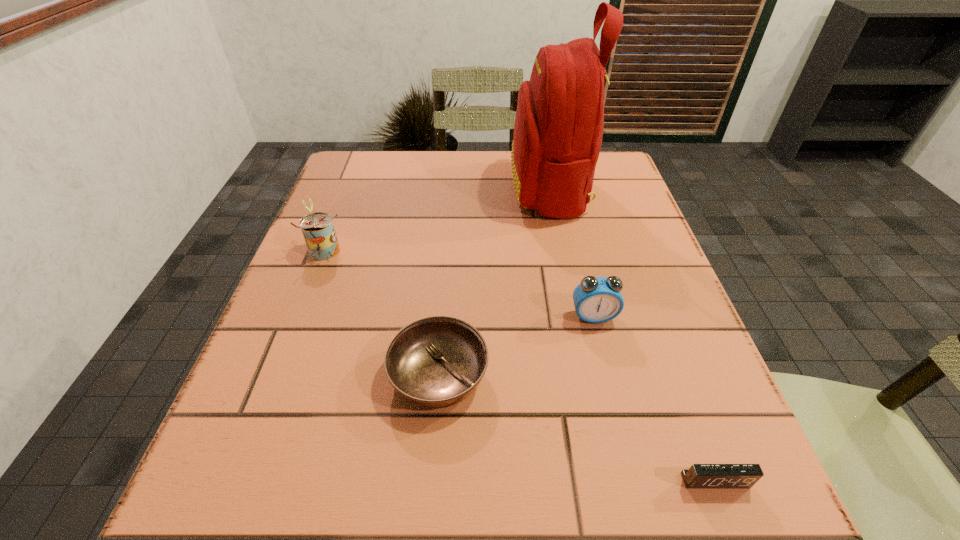
Find the location of a particular element. This screenshot has height=540, width=960. the farthest object is located at coordinates (558, 130).

You are a GUI agent. You are given a task and a screenshot of the screen. Output one action in this format:
    pyautogui.click(x=<x>, y=<y>)
    Task: Click on the backpack
    
    Given the screenshot: What is the action you would take?
    [x=558, y=130]

This screenshot has height=540, width=960. In order to click on the leftmost object in this screenshot , I will do `click(318, 230)`.

Locate an element on the screen. the fourth shortest object is located at coordinates (318, 230).

This screenshot has height=540, width=960. I want to click on the left alarm clock, so click(x=596, y=299).

Image resolution: width=960 pixels, height=540 pixels. Identify the location of the third tallest object. (596, 299).

What are the coordinates of `the second nearest object` in the screenshot? It's located at (434, 362).

Identify the location of the second object from left to right. (434, 362).

The height and width of the screenshot is (540, 960). In order to click on the nearest object in this screenshot , I will do 699,476.

Locate an element on the screen. The height and width of the screenshot is (540, 960). the rightmost object is located at coordinates (699, 476).